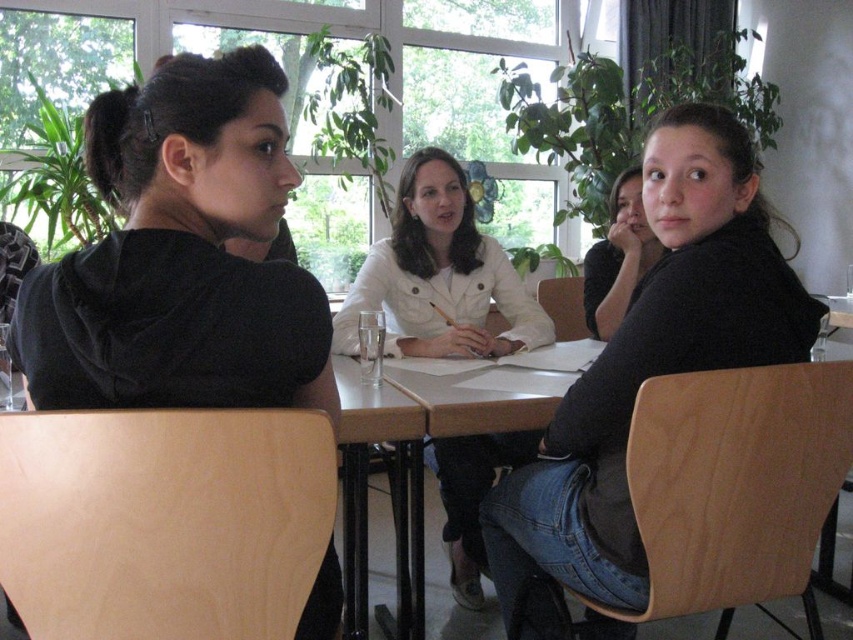
Looking at this image, does black matte jacket at upper right appear over black matte shirt at upper right?

Actually, black matte jacket at upper right is below black matte shirt at upper right.

Who is lower down, black matte jacket at upper right or black matte shirt at upper right?

black matte jacket at upper right is lower down.

Does point (531, 525) lie behind point (627, 193)?

No, (531, 525) is closer to viewer.

You are a GUI agent. You are given a task and a screenshot of the screen. Output one action in this format:
    pyautogui.click(x=<x>, y=<y>)
    Task: Click on the black matte jacket at upper right
    
    Given the screenshot: What is the action you would take?
    click(646, 372)

Can you confirm if black matte jacket at upper right is smaller than black plastic table at center?

No.

At what (x,y) coordinates should I click in order to perform the action: click on black matte jacket at upper right. Please return your answer as a coordinate pair (x, y). The width and height of the screenshot is (853, 640). Looking at the image, I should click on (646, 372).

Is black velvet shirt at left wider than black plastic table at center?

Indeed, black velvet shirt at left has a greater width compared to black plastic table at center.

Is black velvet shirt at left positioned at the back of black plastic table at center?

No, black velvet shirt at left is closer to the viewer.

Describe the element at coordinates (181, 257) in the screenshot. This screenshot has height=640, width=853. I see `black velvet shirt at left` at that location.

The width and height of the screenshot is (853, 640). In order to click on black velvet shirt at left in this screenshot , I will do `click(181, 257)`.